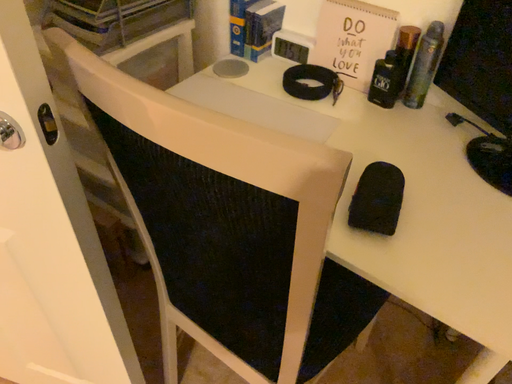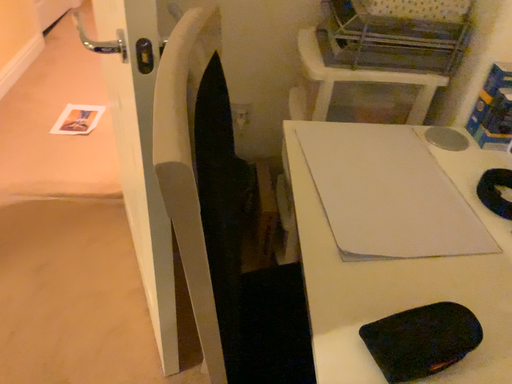
Question: How did the camera likely rotate when shooting the video?

Choices:
 (A) rotated left
 (B) rotated right

Answer: (A)